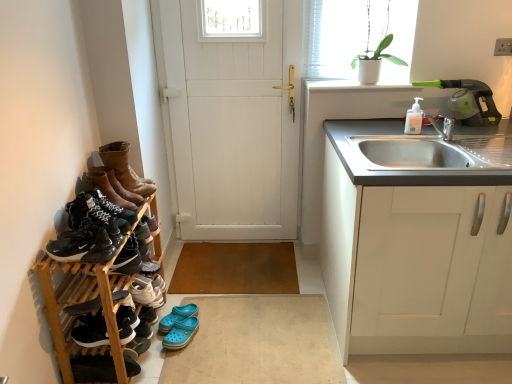
Describe the element at coordinates (93, 368) in the screenshot. I see `black suede shoe at lower left, arranged as the 10th footwear when viewed from the top` at that location.

In order to face blue rubber clogs at lower center, the 8th footwear viewed from the top, should I rotate leftwards or rightwards?

It's best to rotate left around 10.714 degrees.

In order to click on white wooden door at center in this screenshot , I will do `click(233, 122)`.

Image resolution: width=512 pixels, height=384 pixels. Describe the element at coordinates (418, 238) in the screenshot. I see `white matte cabinet at right` at that location.

Describe the element at coordinates (119, 185) in the screenshot. Image resolution: width=512 pixels, height=384 pixels. I see `brown suede boots at left, the ninth footwear ordered from the bottom` at that location.

This screenshot has width=512, height=384. What do you see at coordinates (94, 272) in the screenshot? I see `wooden shoe rack at left` at bounding box center [94, 272].

What do you see at coordinates (83, 247) in the screenshot? I see `shiny black sneakers at left, the seventh footwear positioned from the bottom` at bounding box center [83, 247].

Identify the location of black suede shoe at lower left, arranged as the 10th footwear when viewed from the top. This screenshot has height=384, width=512. (93, 368).

Measure the distance between black matte sneakers at left, arranged as the 1th shoe when viewed from the top, and black matte sneakers at left, placed as the 1th shoe when sorted from bottom to top.

The distance of black matte sneakers at left, arranged as the 1th shoe when viewed from the top, from black matte sneakers at left, placed as the 1th shoe when sorted from bottom to top, is 6.39 inches.

Is black matte sneakers at left, arranged as the 1th shoe when viewed from the top, far away from black matte sneakers at left, placed as the 1th shoe when sorted from bottom to top?

That's not correct — black matte sneakers at left, arranged as the 1th shoe when viewed from the top, is a little close to black matte sneakers at left, placed as the 1th shoe when sorted from bottom to top.

Considering the relative positions of black matte sneakers at left, arranged as the 1th shoe when viewed from the top, and black matte sneakers at left, placed as the 1th shoe when sorted from bottom to top, in the image provided, is black matte sneakers at left, arranged as the 1th shoe when viewed from the top, to the left of black matte sneakers at left, placed as the 1th shoe when sorted from bottom to top, from the viewer's perspective?

Yes.

Is black matte sneakers at left, placed as the 1th shoe when sorted from bottom to top, surrounded by black matte sneakers at left, arranged as the 1th shoe when viewed from the top?

No, black matte sneakers at left, placed as the 1th shoe when sorted from bottom to top, is not surrounded by black matte sneakers at left, arranged as the 1th shoe when viewed from the top.

Does black suede shoe at lower left, positioned as the first footwear in bottom-to-top order, have a smaller size compared to white smooth window sill at upper right?

Yes.

Which is more to the right, black suede shoe at lower left, positioned as the first footwear in bottom-to-top order, or white smooth window sill at upper right?

white smooth window sill at upper right is more to the right.

From a real-world perspective, is black suede shoe at lower left, arranged as the 10th footwear when viewed from the top, over white smooth window sill at upper right?

No.

Which of these two, black suede shoe at lower left, arranged as the 10th footwear when viewed from the top, or white smooth window sill at upper right, stands taller?

With more height is black suede shoe at lower left, arranged as the 10th footwear when viewed from the top.

Which is further, [83,371] or [86,307]?

Point [86,307]

Is black suede shoe at lower left, positioned as the first footwear in bottom-to-top order, completely or partially outside of wooden shoe rack at left?

Actually, black suede shoe at lower left, positioned as the first footwear in bottom-to-top order, is within wooden shoe rack at left.

From the image's perspective, between black suede shoe at lower left, arranged as the 10th footwear when viewed from the top, and wooden shoe rack at left, which one is located above?

wooden shoe rack at left.

Between shiny black sneakers at left, which appears as the 4th footwear when viewed from the top, and leather boots at left, the first footwear positioned from the top, which one has larger width?

Wider between the two is leather boots at left, the first footwear positioned from the top.

Which object is positioned more to the left, shiny black sneakers at left, which appears as the 4th footwear when viewed from the top, or leather boots at left, arranged as the 10th footwear when ordered from the bottom?

shiny black sneakers at left, which appears as the 4th footwear when viewed from the top, is more to the left.

Can you confirm if shiny black sneakers at left, which appears as the 4th footwear when viewed from the top, is bigger than leather boots at left, arranged as the 10th footwear when ordered from the bottom?

Incorrect, shiny black sneakers at left, which appears as the 4th footwear when viewed from the top, is not larger than leather boots at left, arranged as the 10th footwear when ordered from the bottom.

Based on the photo, are shiny black sneakers at left, the seventh footwear positioned from the bottom, and leather boots at left, the first footwear positioned from the top, far apart?

That's not correct — shiny black sneakers at left, the seventh footwear positioned from the bottom, is a little close to leather boots at left, the first footwear positioned from the top.

Which object is more forward, blue rubber clogs at lower center or black matte sneakers at left, arranged as the 1th shoe when viewed from the top?

black matte sneakers at left, arranged as the 1th shoe when viewed from the top, is closer to the camera.

Starting from the blue rubber clogs at lower center, which shoe is the 2nd one to the left? Please provide its 2D coordinates.

[(112, 207)]

How different are the orientations of blue rubber clogs at lower center and black matte sneakers at left, acting as the second shoe starting from the bottom, in degrees?

The angular difference between blue rubber clogs at lower center and black matte sneakers at left, acting as the second shoe starting from the bottom, is 5.38 degrees.

How distant is blue rubber clogs at lower center from black matte sneakers at left, acting as the second shoe starting from the bottom?

blue rubber clogs at lower center and black matte sneakers at left, acting as the second shoe starting from the bottom, are 34.80 inches apart from each other.

Could black suede sneakers at lower left, which ranks as the 7th footwear in top-to-bottom order, be considered to be inside white wooden door at center?

No, black suede sneakers at lower left, which ranks as the 7th footwear in top-to-bottom order, is located outside of white wooden door at center.

Can you confirm if white wooden door at center is taller than black suede sneakers at lower left, which is counted as the fourth footwear, starting from the bottom?

Yes.

Is white wooden door at center turned away from black suede sneakers at lower left, which is counted as the fourth footwear, starting from the bottom?

white wooden door at center is not turned away from black suede sneakers at lower left, which is counted as the fourth footwear, starting from the bottom.

Is wooden shoe rack at left oriented towards white wooden door at center?

No, wooden shoe rack at left is not oriented towards white wooden door at center.

Is wooden shoe rack at left positioned before white wooden door at center?

Yes, wooden shoe rack at left is closer to the camera.

Who is smaller, wooden shoe rack at left or white wooden door at center?

With smaller size is white wooden door at center.

The image size is (512, 384). In the image, there is a black matte sneakers at left, arranged as the 1th shoe when viewed from the top. Find the location of `shoe below it (from the image's perspective)`. shoe below it (from the image's perspective) is located at coordinates (128, 259).

The height and width of the screenshot is (384, 512). I want to click on window sill above the black suede shoe at lower left, positioned as the first footwear in bottom-to-top order (from a real-world perspective), so click(356, 86).

Based on their spatial positions, is black mesh sneakers at left, marked as the third footwear in a top-to-bottom arrangement, or black matte sneakers at left, placed as the 1th shoe when sorted from bottom to top, closer to shiny black sneakers at left, which appears as the 4th footwear when viewed from the top?

Among the two, black mesh sneakers at left, marked as the third footwear in a top-to-bottom arrangement, is located nearer to shiny black sneakers at left, which appears as the 4th footwear when viewed from the top.

Based on their spatial positions, is white ceramic pot at upper right or wooden shoe rack at left closer to green plastic vacuum cleaner at upper right?

white ceramic pot at upper right.

Based on their spatial positions, is black mesh sneakers at left, marked as the third footwear in a top-to-bottom arrangement, or blue rubber clogs at lower center, the second footwear in the bottom-to-top sequence, closer to blue rubber clogs at lower center?

blue rubber clogs at lower center, the second footwear in the bottom-to-top sequence, is closer to blue rubber clogs at lower center.

Looking at the image, which one is located closer to blue rubber clogs at lower center, black matte sneakers at lower left, acting as the sixth footwear starting from the bottom, or green plastic vacuum cleaner at upper right?

black matte sneakers at lower left, acting as the sixth footwear starting from the bottom.

From the image, which object appears to be nearer to black mesh sneakers at left, which appears as the eighth footwear when ordered from the bottom, green plastic vacuum cleaner at upper right or black matte sneakers at lower left, marked as the fifth footwear in a top-to-bottom arrangement?

Based on the image, black matte sneakers at lower left, marked as the fifth footwear in a top-to-bottom arrangement, appears to be nearer to black mesh sneakers at left, which appears as the eighth footwear when ordered from the bottom.

Based on their spatial positions, is shiny black sneakers at left, which appears as the 4th footwear when viewed from the top, or black suede sneakers at lower left, which ranks as the 5th footwear in bottom-to-top order, further from white wooden door at center?

The object further to white wooden door at center is black suede sneakers at lower left, which ranks as the 5th footwear in bottom-to-top order.

Estimate the real-world distances between objects in this image. Which object is further from white matte cabinet at right, black suede shoe at lower left, arranged as the 10th footwear when viewed from the top, or brown suede boots at left, the ninth footwear ordered from the bottom?

black suede shoe at lower left, arranged as the 10th footwear when viewed from the top, is positioned further to the anchor white matte cabinet at right.

Estimate the real-world distances between objects in this image. Which object is closer to white ceramic pot at upper right, white ceramic plant at upper right or blue rubber clogs at lower center, the 8th footwear viewed from the top?

Based on the image, white ceramic plant at upper right appears to be nearer to white ceramic pot at upper right.

Identify the location of carpetry that lies between white ceramic plant at upper right and black suede sneakers at lower left, which ranks as the 5th footwear in bottom-to-top order, from top to bottom. (94, 272).

Find the location of `footwear between black mesh sneakers at left, marked as the third footwear in a top-to-bottom arrangement, and black matte sneakers at lower left, marked as the fifth footwear in a top-to-bottom arrangement, in the up-down direction`. footwear between black mesh sneakers at left, marked as the third footwear in a top-to-bottom arrangement, and black matte sneakers at lower left, marked as the fifth footwear in a top-to-bottom arrangement, in the up-down direction is located at coordinates (83, 247).

Locate an element on the screen. window between black mesh sneakers at left, which appears as the eighth footwear when ordered from the bottom, and white smooth window sill at upper right, in the horizontal direction is located at coordinates (359, 37).

Image resolution: width=512 pixels, height=384 pixels. What are the coordinates of `door between black matte sneakers at left, acting as the second shoe starting from the bottom, and green plastic vacuum cleaner at upper right, in the horizontal direction` in the screenshot? It's located at point(233,122).